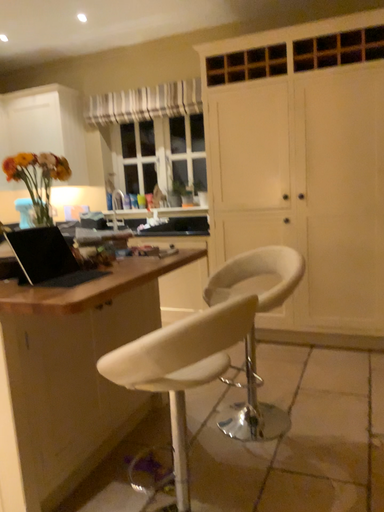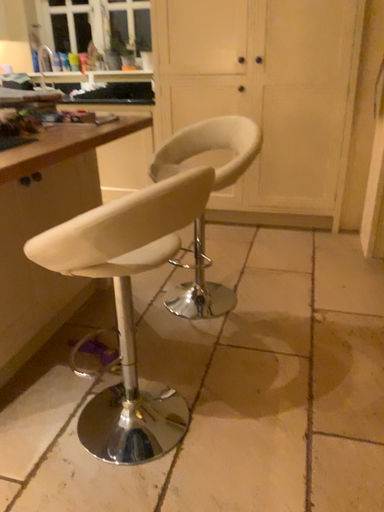
Question: Which way did the camera rotate in the video?

Choices:
 (A) rotated right
 (B) rotated left

Answer: (A)